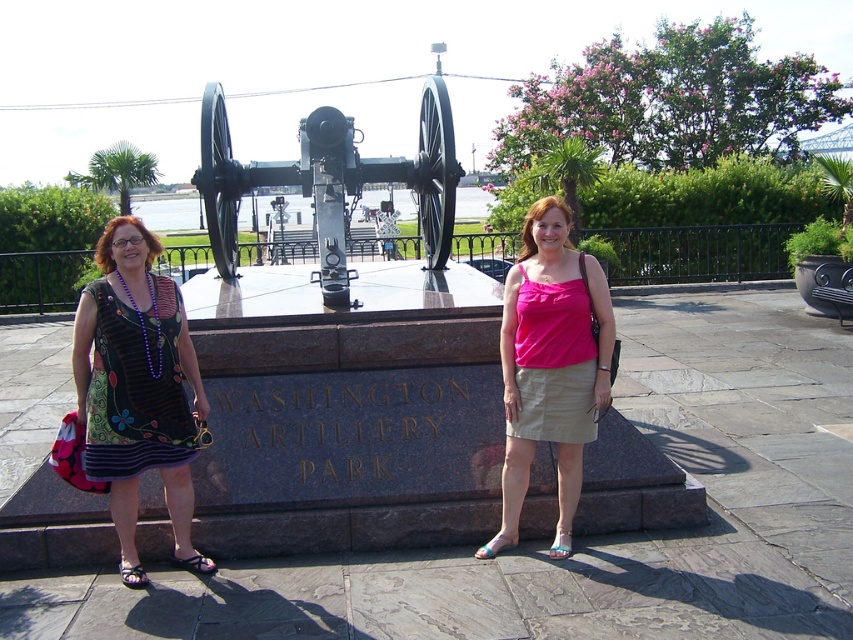
Question: Does floral dress at left have a smaller size compared to pink fabric tank top at center?

Choices:
 (A) yes
 (B) no

Answer: (A)

Question: Is floral dress at left above pink fabric tank top at center?

Choices:
 (A) yes
 (B) no

Answer: (B)

Question: Which object is farther from the camera taking this photo?

Choices:
 (A) floral dress at left
 (B) pink fabric tank top at center

Answer: (B)

Question: Which of the following is the closest to the observer?

Choices:
 (A) floral dress at left
 (B) pink fabric tank top at center

Answer: (A)

Question: Is floral dress at left above pink fabric tank top at center?

Choices:
 (A) yes
 (B) no

Answer: (B)

Question: Which object appears farthest from the camera in this image?

Choices:
 (A) floral dress at left
 (B) pink fabric tank top at center

Answer: (B)